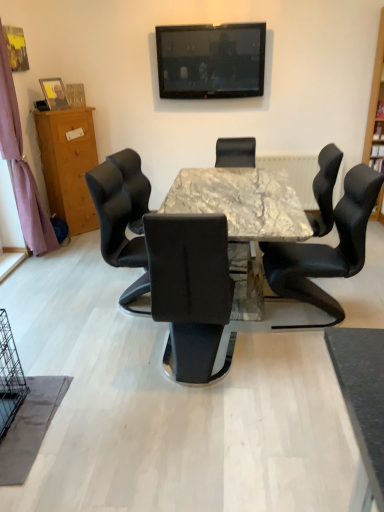
Question: From the image's perspective, is black leather chair at center, the first chair viewed from the back, under black leather chair at right, the third chair in the back-to-front sequence?

Choices:
 (A) yes
 (B) no

Answer: (B)

Question: Is black leather chair at center, acting as the third chair starting from the front, outside of black leather chair at right, the first chair from the front?

Choices:
 (A) no
 (B) yes

Answer: (B)

Question: Can you confirm if black leather chair at center, the first chair viewed from the back, is taller than black leather chair at right, the third chair in the back-to-front sequence?

Choices:
 (A) no
 (B) yes

Answer: (A)

Question: Is black leather chair at right, the third chair in the back-to-front sequence, a part of black leather chair at center, the first chair viewed from the back?

Choices:
 (A) yes
 (B) no

Answer: (B)

Question: Is black leather chair at center, acting as the third chair starting from the front, closer to the viewer compared to black leather chair at right, the third chair in the back-to-front sequence?

Choices:
 (A) no
 (B) yes

Answer: (A)

Question: Is black leather chair at center, the first chair viewed from the back, with black leather chair at right, the first chair from the front?

Choices:
 (A) no
 (B) yes

Answer: (A)

Question: Is black leather chair at center, acting as the third chair starting from the front, looking in the opposite direction of wooden bookshelf at right?

Choices:
 (A) yes
 (B) no

Answer: (B)

Question: Does black leather chair at center, the first chair viewed from the back, have a greater width compared to wooden bookshelf at right?

Choices:
 (A) yes
 (B) no

Answer: (A)

Question: Is black leather chair at center, acting as the third chair starting from the front, far from wooden bookshelf at right?

Choices:
 (A) no
 (B) yes

Answer: (B)

Question: Is black leather chair at center, acting as the third chair starting from the front, outside wooden bookshelf at right?

Choices:
 (A) yes
 (B) no

Answer: (A)

Question: From the image's perspective, is black leather chair at center, acting as the third chair starting from the front, under wooden bookshelf at right?

Choices:
 (A) no
 (B) yes

Answer: (B)

Question: Is black leather chair at center, acting as the third chair starting from the front, surrounding wooden bookshelf at right?

Choices:
 (A) yes
 (B) no

Answer: (B)

Question: Is wooden cabinet at left to the left of black glossy television at upper center from the viewer's perspective?

Choices:
 (A) yes
 (B) no

Answer: (A)